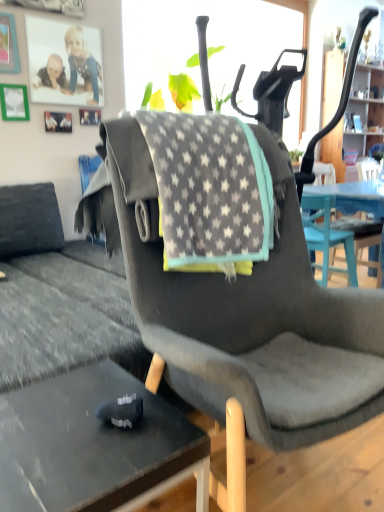
Question: Considering the relative sizes of gray star-patterned fabric at center and black glass desk at lower left in the image provided, is gray star-patterned fabric at center shorter than black glass desk at lower left?

Choices:
 (A) yes
 (B) no

Answer: (B)

Question: Considering the relative positions of gray star-patterned fabric at center and black glass desk at lower left in the image provided, is gray star-patterned fabric at center to the right of black glass desk at lower left from the viewer's perspective?

Choices:
 (A) no
 (B) yes

Answer: (B)

Question: Is gray star-patterned fabric at center further to camera compared to black glass desk at lower left?

Choices:
 (A) yes
 (B) no

Answer: (A)

Question: Considering the relative sizes of gray star-patterned fabric at center and black glass desk at lower left in the image provided, is gray star-patterned fabric at center taller than black glass desk at lower left?

Choices:
 (A) yes
 (B) no

Answer: (A)

Question: Can you confirm if gray star-patterned fabric at center is positioned to the left of black glass desk at lower left?

Choices:
 (A) no
 (B) yes

Answer: (A)

Question: Relative to wooden cabinet at upper right, is black glass desk at lower left in front or behind?

Choices:
 (A) behind
 (B) front

Answer: (B)

Question: In terms of width, does black glass desk at lower left look wider or thinner when compared to wooden cabinet at upper right?

Choices:
 (A) thin
 (B) wide

Answer: (B)

Question: Which is correct: black glass desk at lower left is inside wooden cabinet at upper right, or outside of it?

Choices:
 (A) inside
 (B) outside

Answer: (B)

Question: From a real-world perspective, is black glass desk at lower left positioned above or below wooden cabinet at upper right?

Choices:
 (A) above
 (B) below

Answer: (B)

Question: Visually, is wooden cabinet at upper right positioned to the left or to the right of black glass desk at lower left?

Choices:
 (A) right
 (B) left

Answer: (A)

Question: Is wooden cabinet at upper right spatially inside black glass desk at lower left, or outside of it?

Choices:
 (A) outside
 (B) inside

Answer: (A)

Question: Is wooden cabinet at upper right wider or thinner than black glass desk at lower left?

Choices:
 (A) thin
 (B) wide

Answer: (A)

Question: Is wooden cabinet at upper right bigger or smaller than black glass desk at lower left?

Choices:
 (A) small
 (B) big

Answer: (B)

Question: Is black glass desk at lower left taller or shorter than gray star-patterned fabric at center?

Choices:
 (A) tall
 (B) short

Answer: (B)

Question: From a real-world perspective, is black glass desk at lower left above or below gray star-patterned fabric at center?

Choices:
 (A) below
 (B) above

Answer: (A)